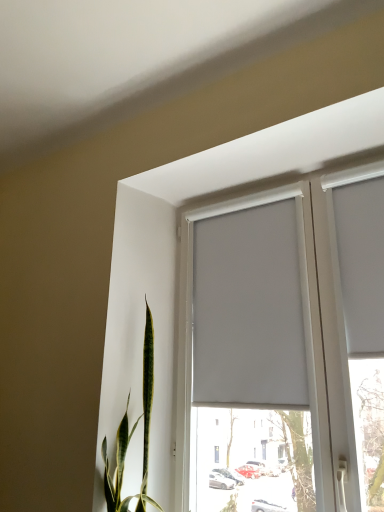
Question: Considering the positions of white matte curtain at upper right, the 1th curtain when ordered from right to left, and white matte window at center in the image, is white matte curtain at upper right, the 1th curtain when ordered from right to left, wider or thinner than white matte window at center?

Choices:
 (A) thin
 (B) wide

Answer: (A)

Question: From their relative heights in the image, would you say white matte curtain at upper right, the 1th curtain when ordered from right to left, is taller or shorter than white matte window at center?

Choices:
 (A) tall
 (B) short

Answer: (B)

Question: Which object is the farthest from the white matte curtain at upper right, which is counted as the second curtain, starting from the left?

Choices:
 (A) white matte window at center
 (B) white matte curtain at upper center, the 2th curtain from the right

Answer: (A)

Question: Considering the real-world distances, which object is closest to the white matte curtain at upper center, the first curtain positioned from the left?

Choices:
 (A) white matte window at center
 (B) white matte curtain at upper right, the 1th curtain when ordered from right to left

Answer: (A)